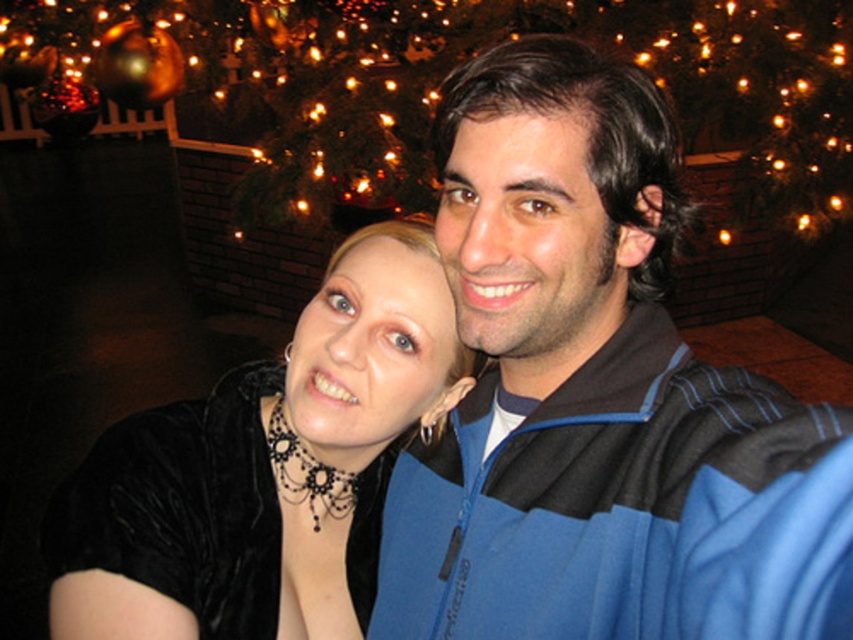
In the scene shown: You are a photographer standing at the position where the original photo was taken. You want to ensure that both the velvet black dress at center and the metallic gold ornament at upper center are in focus. Given that your camera has a depth of field range of 5 feet, will both objects be in focus?

The velvet black dress at center is 5.62 feet away from the metallic gold ornament at upper center. Since the distance between them exceeds the camera depth of field range of 5 feet, both objects cannot be in focus simultaneously.

You are a photographer trying to capture a clear shot of both the velvet black dress at center and the metallic gold ornament at upper center. Since the background is slightly out of focus, which object should you adjust your camera focus on to ensure both are in focus?

To ensure both the velvet black dress at center and the metallic gold ornament at upper center are in focus, adjust the camera focus on the velvet black dress at center because it is closer to the viewer. This will create a depth of field that includes the metallic gold ornament at upper center, which is farther away.

Consider the image. You are a photographer adjusting the focus on this festive photo. The velvet black dress at center and the metallic gold ornament at upper center are both in the frame. Which object should you adjust the focus on if you want to prioritize the thinner item?

The velvet black dress at center is thinner than the metallic gold ornament at upper center, so you should adjust the focus on the velvet black dress at center.